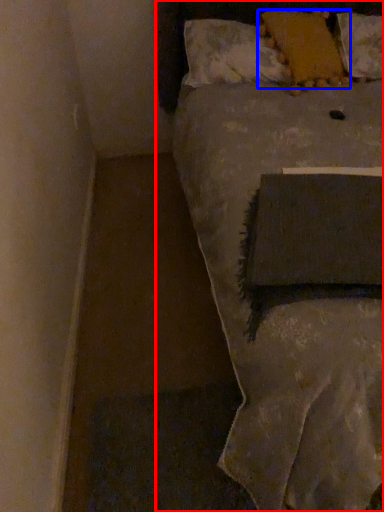
Question: Which of the following is the closest to the observer, bed (highlighted by a red box) or pillow (highlighted by a blue box)?

Choices:
 (A) bed
 (B) pillow

Answer: (A)